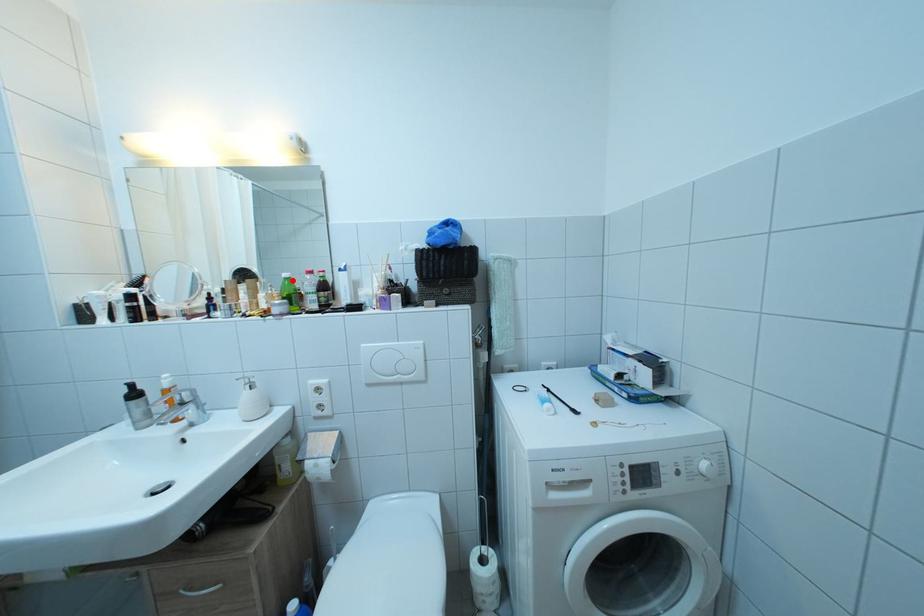
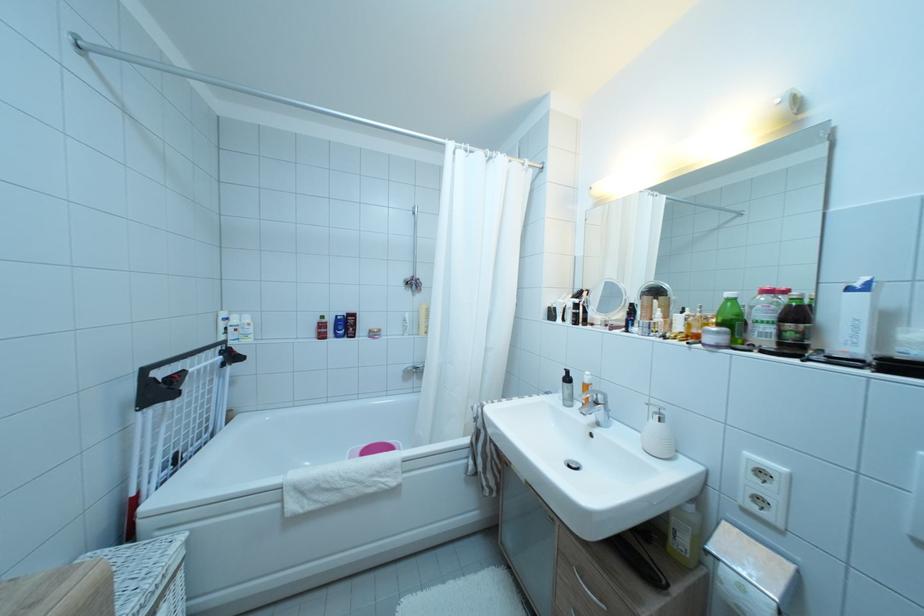
Locate, in the second image, the point that corresponds to the highlighted location in the first image.

(736, 300)